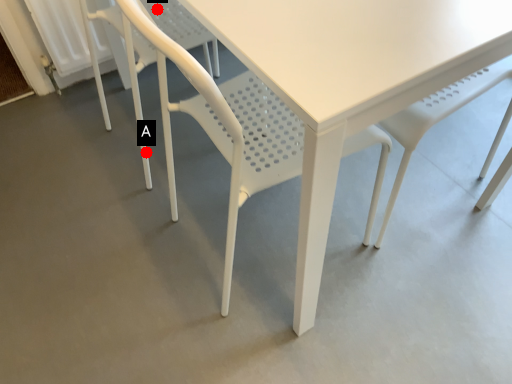
Question: Two points are circled on the image, labeled by A and B beside each circle. Which point appears closest to the camera in this image?

Choices:
 (A) A is closer
 (B) B is closer

Answer: (B)